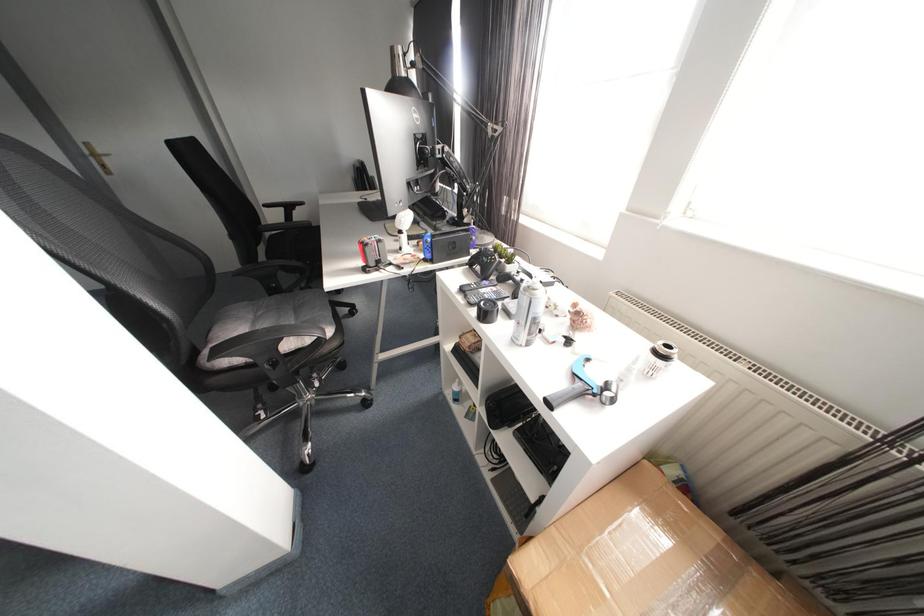
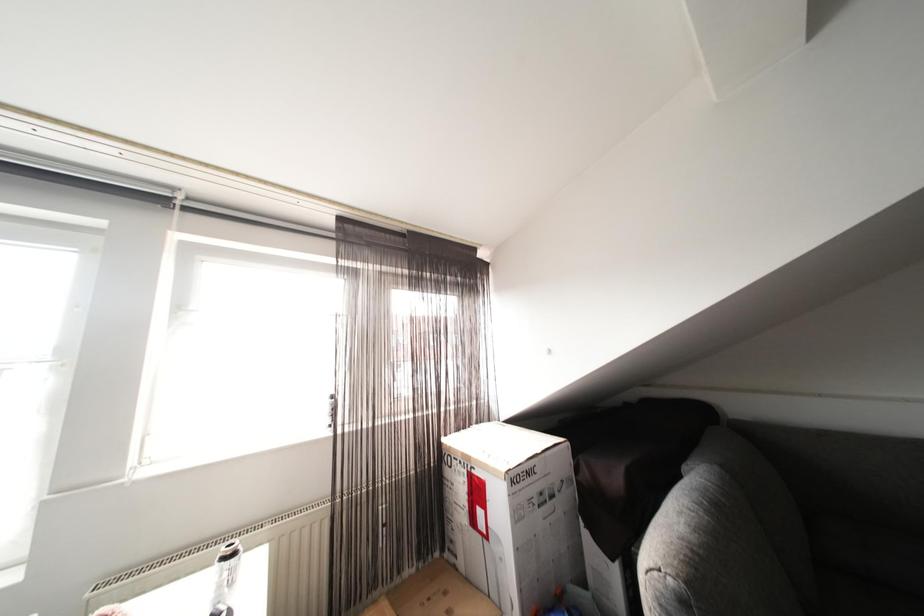
Question: The camera is either moving clockwise (left) or counter-clockwise (right) around the object. The first image is from the beginning of the video and the second image is from the end. Is the camera moving left or right when shooting the video?

Choices:
 (A) Left
 (B) Right

Answer: (A)